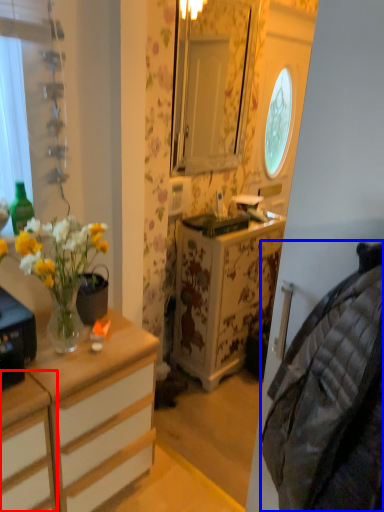
Question: Which point is closer to the camera, cabinetry (highlighted by a red box) or material (highlighted by a blue box)?

Choices:
 (A) cabinetry
 (B) material

Answer: (B)